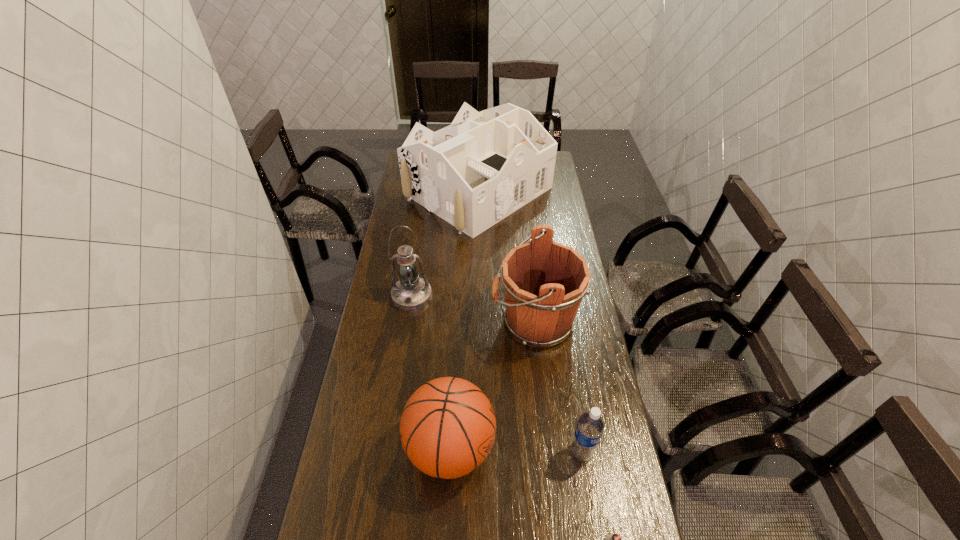
Identify the location of vacant space located on the back of the basketball. (456, 341).

Identify the location of free region located on the back of the water bottle. (564, 347).

In order to click on object at the far edge in this screenshot , I will do `click(475, 172)`.

You are a GUI agent. You are given a task and a screenshot of the screen. Output one action in this format:
    pyautogui.click(x=<x>, y=<y>)
    Task: Click on the dollhouse that is positioned at the left edge
    
    Given the screenshot: What is the action you would take?
    pyautogui.click(x=475, y=172)

Locate an element on the screen. This screenshot has width=960, height=540. oil lamp present at the left edge is located at coordinates (411, 293).

This screenshot has height=540, width=960. Identify the location of dollhouse located at the right edge. (475, 172).

Locate an element on the screen. This screenshot has height=540, width=960. bucket at the right edge is located at coordinates (544, 281).

Locate an element on the screen. water bottle present at the right edge is located at coordinates (590, 426).

Locate an element on the screen. The width and height of the screenshot is (960, 540). object present at the far left corner is located at coordinates (475, 172).

Identify the location of object that is at the far right corner. (475, 172).